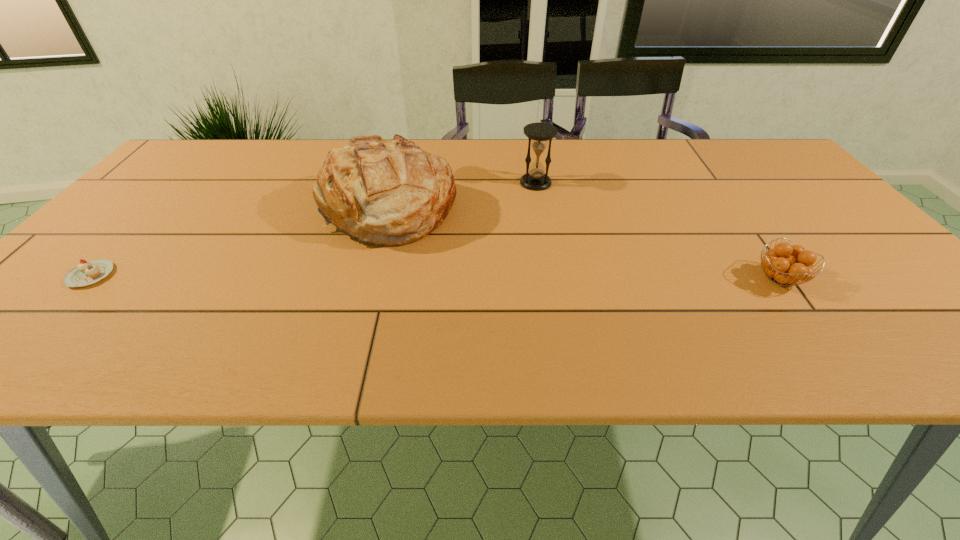
You are a GUI agent. You are given a task and a screenshot of the screen. Output one action in this format:
    pyautogui.click(x=<x>, y=<y>)
    Task: Click on the vacant area that lies between the bread and the second shortest object
    The height and width of the screenshot is (540, 960).
    Given the screenshot: What is the action you would take?
    pyautogui.click(x=585, y=245)

Select which object is the third closest to the cupcake. Please provide its 2D coordinates. Your answer should be formatted as a tuple, i.e. [(x, y)], where the tuple contains the x and y coordinates of a point satisfying the conditions above.

[(785, 264)]

Identify which object is the third nearest to the bread. Please provide its 2D coordinates. Your answer should be formatted as a tuple, i.e. [(x, y)], where the tuple contains the x and y coordinates of a point satisfying the conditions above.

[(785, 264)]

Locate an element on the screen. free point that satisfies the following two spatial constraints: 1. on the back side of the shortest object; 2. on the right side of the second object from right to left is located at coordinates (179, 183).